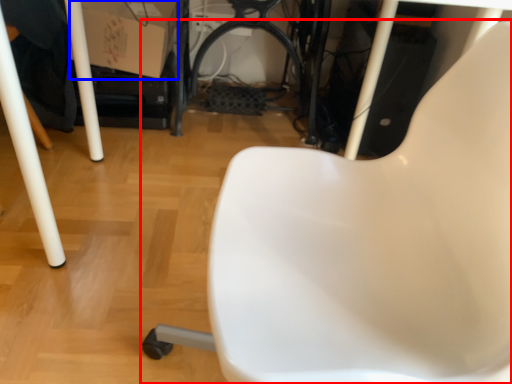
Question: Which object appears closest to the camera in this image, chair (highlighted by a red box) or cardboard box (highlighted by a blue box)?

Choices:
 (A) chair
 (B) cardboard box

Answer: (A)